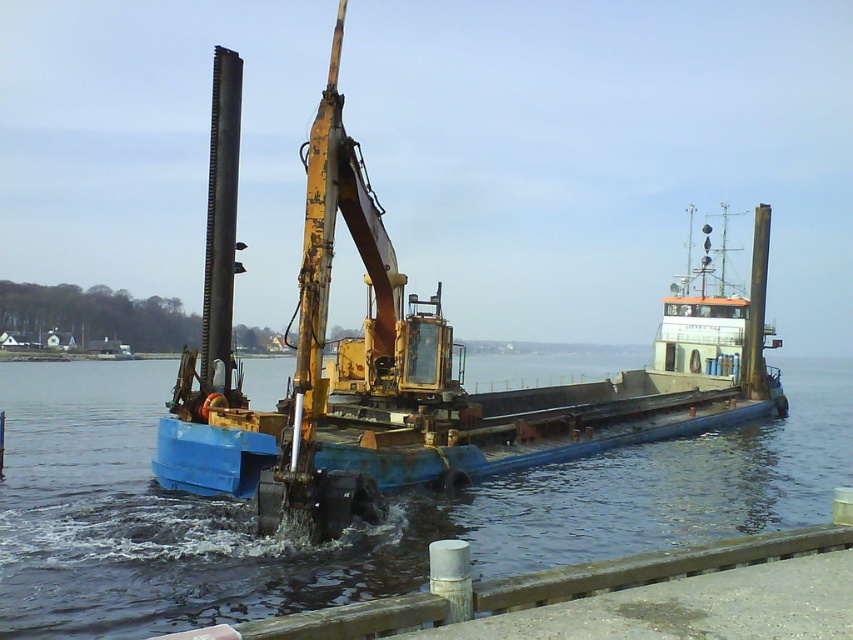
Which is behind, point (223, 529) or point (264, 456)?

The point (264, 456) is more distant.

Does blue metallic water at center come behind blue painted steel barge at center?

No.

Is point (39, 528) closer to viewer compared to point (351, 141)?

No, it is not.

Where is `blue metallic water at center`? The height and width of the screenshot is (640, 853). blue metallic water at center is located at coordinates (354, 529).